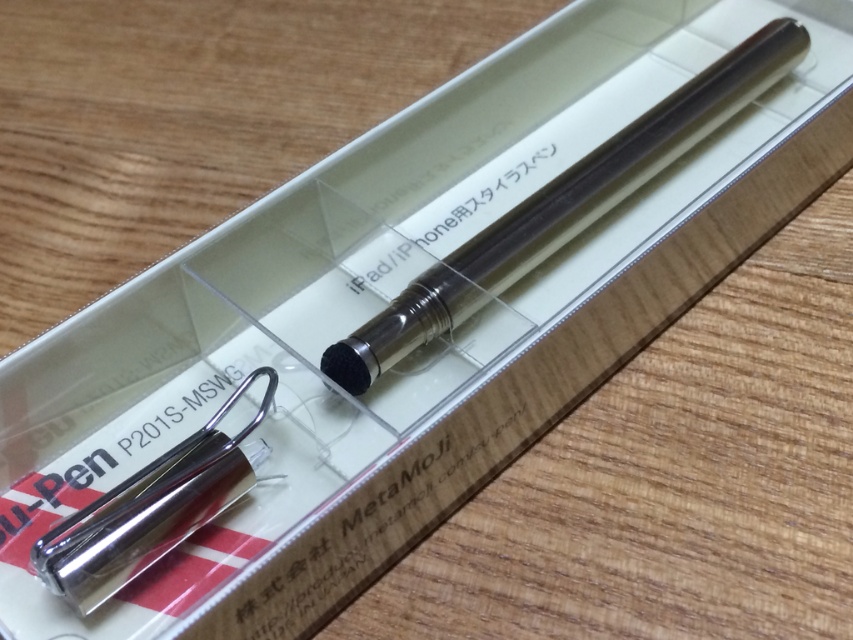
This screenshot has width=853, height=640. Describe the element at coordinates (563, 205) in the screenshot. I see `satin silver pen at center` at that location.

Is satin silver pen at center to the right of polished silver pen at lower left from the viewer's perspective?

Yes, satin silver pen at center is to the right of polished silver pen at lower left.

Which is behind, point (636, 186) or point (231, 497)?

Positioned behind is point (636, 186).

You are a GUI agent. You are given a task and a screenshot of the screen. Output one action in this format:
    pyautogui.click(x=<x>, y=<y>)
    Task: Click on the satin silver pen at center
    The height and width of the screenshot is (640, 853).
    Given the screenshot: What is the action you would take?
    pyautogui.click(x=563, y=205)